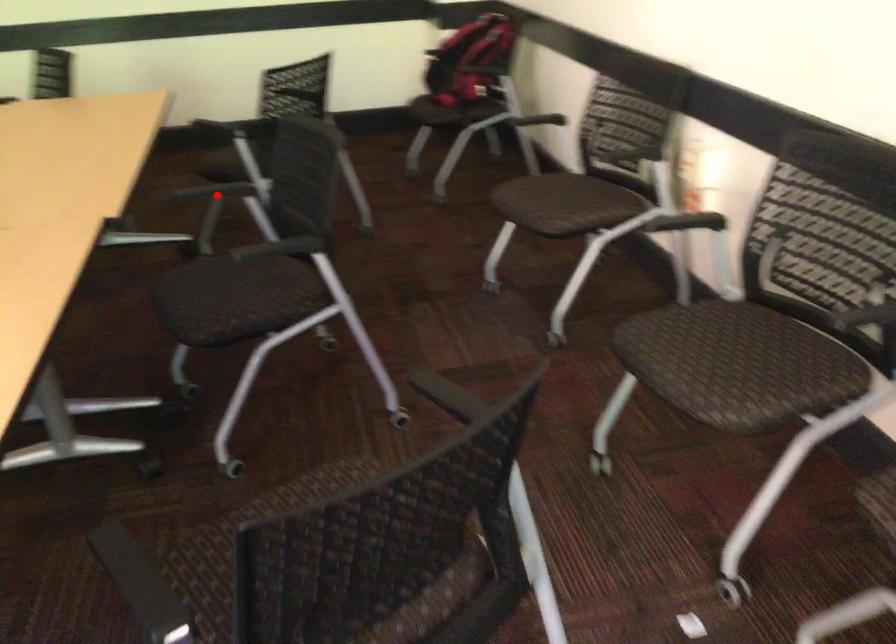
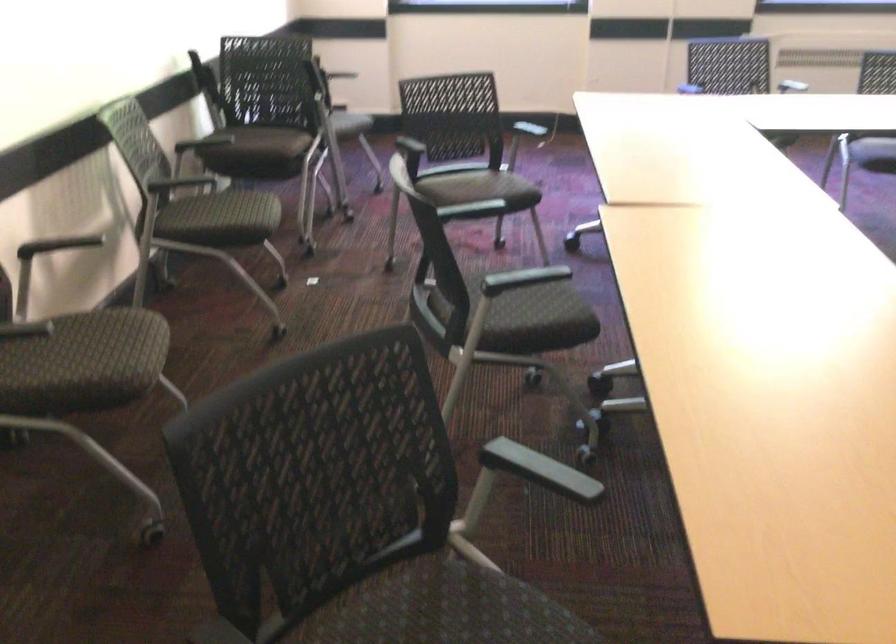
Find the pixel in the second image that matches the highlighted location in the first image.

(522, 279)